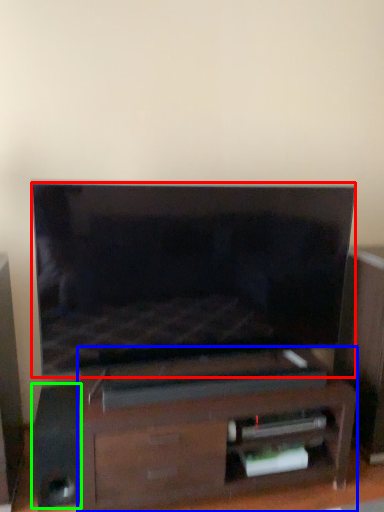
Question: Which object is positioned closest to television (highlighted by a red box)? Select from furniture (highlighted by a blue box) and speaker (highlighted by a green box).

Choices:
 (A) furniture
 (B) speaker

Answer: (A)